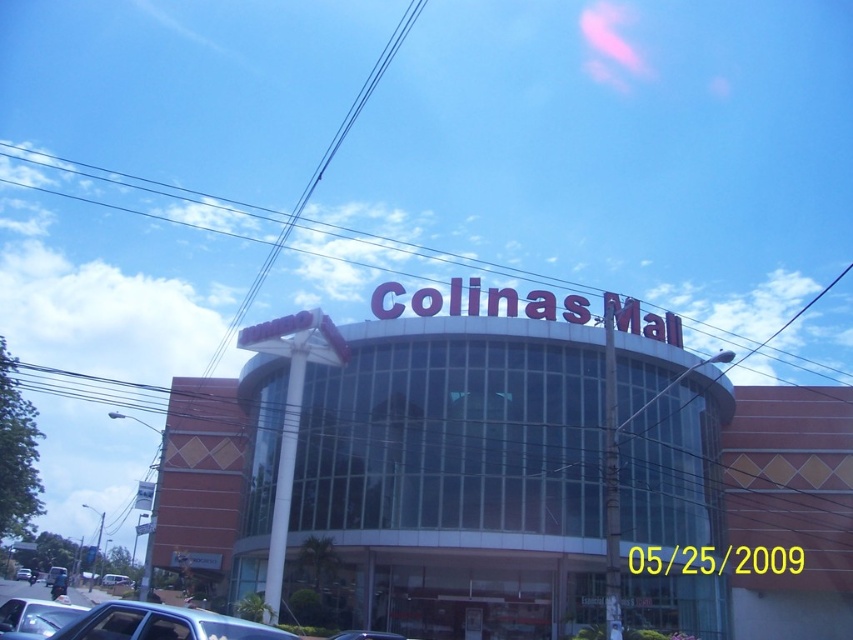
Question: Which of the following is the farthest from the observer?

Choices:
 (A) (352, 618)
 (B) (109, 582)
 (C) (120, 624)

Answer: (B)

Question: Does orange glass building at center come in front of metallic blue sedan at lower left?

Choices:
 (A) yes
 (B) no

Answer: (B)

Question: Does silver metallic car at lower left lie in front of metallic silver car at lower left?

Choices:
 (A) yes
 (B) no

Answer: (B)

Question: Can you confirm if orange glass building at center is positioned to the left of metallic blue sedan at lower left?

Choices:
 (A) yes
 (B) no

Answer: (B)

Question: Which object is positioned farthest from the metallic blue sedan at lower left?

Choices:
 (A) silver metallic car at lower left
 (B) metallic silver car at lower left
 (C) orange glass building at center

Answer: (B)

Question: Which is nearer to the metallic blue sedan at lower left?

Choices:
 (A) metallic silver car at center
 (B) metallic silver car at lower left

Answer: (B)